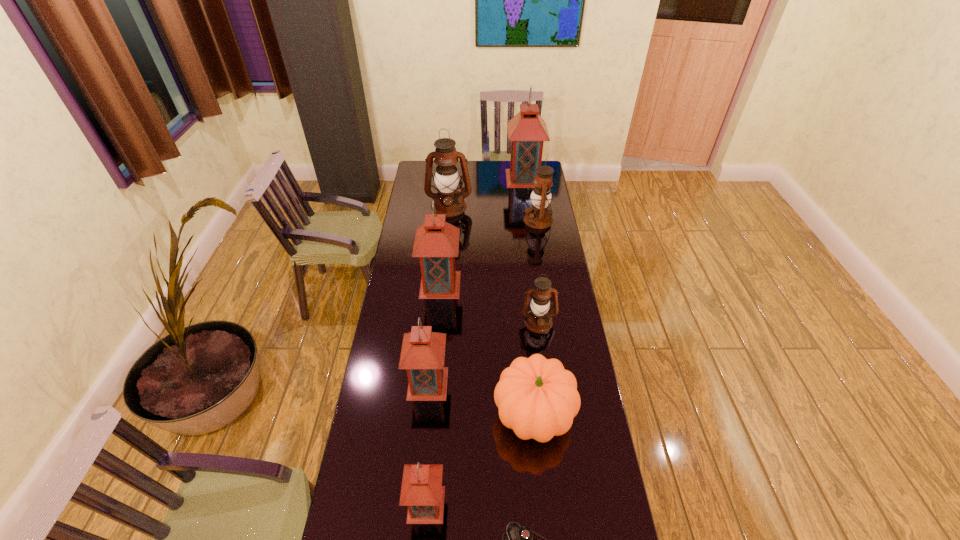
Select which pink lantern is the closest to the smallest pink lantern. Please provide its 2D coordinates. Your answer should be formatted as a tuple, i.e. [(x, y)], where the tuple contains the x and y coordinates of a point satisfying the conditions above.

[(423, 352)]

What are the coordinates of `the third closest brown lantern to the second smallest pink lantern` in the screenshot? It's located at (449, 201).

Where is `brown lantern that is the third closest to the third biggest pink lantern`? brown lantern that is the third closest to the third biggest pink lantern is located at coordinates (449, 201).

Locate an element on the screen. free space that satisfies the following two spatial constraints: 1. on the side of the second smallest brown lantern, there is a wick adjustment knob; 2. on the front side of the third biggest pink lantern is located at coordinates (564, 383).

Locate an element on the screen. free space in the image that satisfies the following two spatial constraints: 1. on the front side of the second nearest lantern; 2. on the right side of the smallest pink lantern is located at coordinates (416, 504).

You are a GUI agent. You are given a task and a screenshot of the screen. Output one action in this format:
    pyautogui.click(x=<x>, y=<y>)
    Task: Click on the vacant space that satisfies the following two spatial constraints: 1. on the side of the leftmost brown lantern, there is a wick adjustment knob; 2. on the left side of the pumpkin
    
    Given the screenshot: What is the action you would take?
    point(431,415)

Locate an element on the screen. Image resolution: width=960 pixels, height=540 pixels. blank area in the image that satisfies the following two spatial constraints: 1. on the side of the second biggest brown lantern, there is a wick adjustment knob; 2. on the front side of the second nearest object is located at coordinates (583, 504).